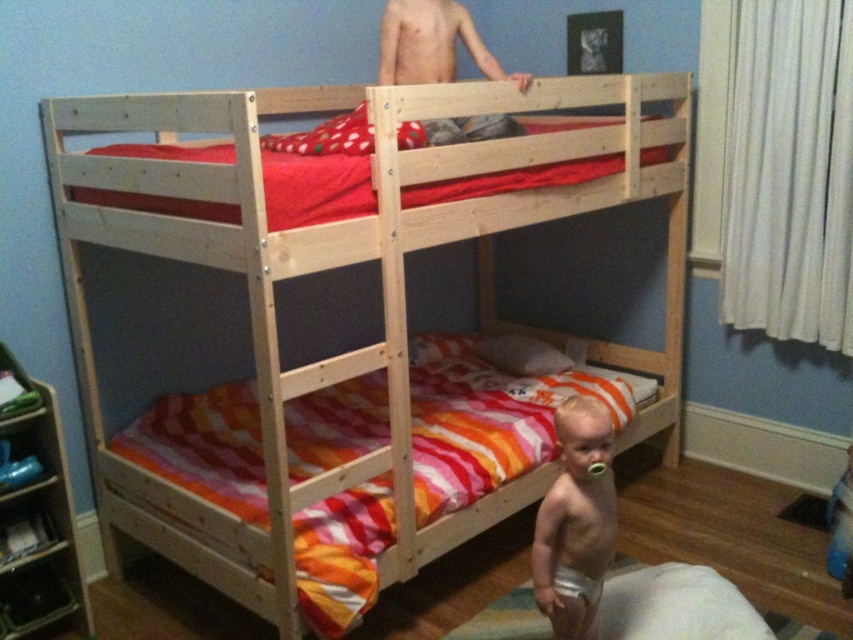
You are a parent trying to move your baby to a different room. The baby is currently standing at the center of the room near the natural wood bunk bed at center. You want to carry the smooth beige baby at center through the doorway, which is 2 meters wide. Can the baby fit through the doorway without any issues?

The natural wood bunk bed at center is wider than the smooth beige baby at center. Since the doorway is 2 meters wide, the baby can easily fit through the doorway as their width is smaller than the doorway.

You are a photographer trying to capture a closeup shot of the smooth beige baby at center and the white cloth diaper at lower center. Which object should you focus on first to ensure the baby is in focus?

You should focus on the smooth beige baby at center first because it is closer to the viewer than the white cloth diaper at lower center. Since the baby is closer, focusing on it will ensure it is in sharp focus while the diaper may appear slightly out of focus due to the distance difference.

You are a parent trying to dress your baby. You have a white cloth diaper at lower center and a smooth beige baby at center. Which item is wider?

The smooth beige baby at center is wider than the white cloth diaper at lower center.